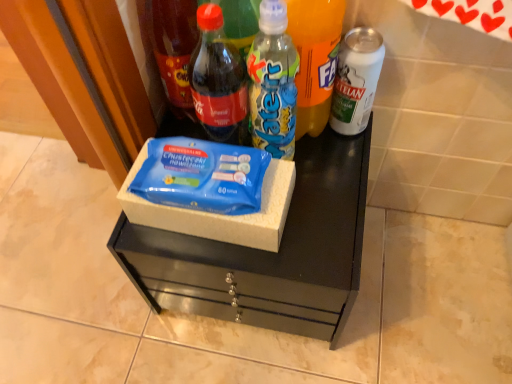
Question: Can you confirm if translucent plastic water bottle at center, which is counted as the third bottle, starting from the right, is smaller than matte glass bottle at upper left, which ranks as the first bottle in left-to-right order?

Choices:
 (A) yes
 (B) no

Answer: (A)

Question: Would you say translucent plastic water bottle at center, which is counted as the third bottle, starting from the right, is a long distance from matte glass bottle at upper left, which ranks as the first bottle in left-to-right order?

Choices:
 (A) no
 (B) yes

Answer: (A)

Question: Is translucent plastic water bottle at center, the 3th bottle from the left, behind matte glass bottle at upper left, arranged as the 5th bottle when viewed from the right?

Choices:
 (A) no
 (B) yes

Answer: (A)

Question: From the image's perspective, is translucent plastic water bottle at center, the 3th bottle from the left, located above matte glass bottle at upper left, which ranks as the first bottle in left-to-right order?

Choices:
 (A) yes
 (B) no

Answer: (B)

Question: From a real-world perspective, does translucent plastic water bottle at center, which is counted as the third bottle, starting from the right, stand above matte glass bottle at upper left, which ranks as the first bottle in left-to-right order?

Choices:
 (A) yes
 (B) no

Answer: (B)

Question: Is blue matte wipes at center wider or thinner than translucent plastic bottle at center, the fourth bottle positioned from the left?

Choices:
 (A) wide
 (B) thin

Answer: (A)

Question: Based on their positions, is blue matte wipes at center located to the left or right of translucent plastic bottle at center, placed as the second bottle when sorted from right to left?

Choices:
 (A) right
 (B) left

Answer: (B)

Question: Is point (302, 213) positioned closer to the camera than point (308, 77)?

Choices:
 (A) farther
 (B) closer

Answer: (A)

Question: Choose the correct answer: Is blue matte wipes at center inside translucent plastic bottle at center, the fourth bottle positioned from the left, or outside it?

Choices:
 (A) outside
 (B) inside

Answer: (A)

Question: Is translucent plastic water bottle at center, which is counted as the third bottle, starting from the right, in front of or behind blue matte wipes at center in the image?

Choices:
 (A) behind
 (B) front

Answer: (B)

Question: Looking at their shapes, would you say translucent plastic water bottle at center, which is counted as the third bottle, starting from the right, is wider or thinner than blue matte wipes at center?

Choices:
 (A) thin
 (B) wide

Answer: (A)

Question: Which is correct: translucent plastic water bottle at center, which is counted as the third bottle, starting from the right, is inside blue matte wipes at center, or outside of it?

Choices:
 (A) outside
 (B) inside

Answer: (A)

Question: Does point (283, 36) appear closer or farther from the camera than point (357, 228)?

Choices:
 (A) closer
 (B) farther

Answer: (A)

Question: From a real-world perspective, is matte glass bottle at center, positioned as the second bottle in left-to-right order, above or below white matte can at right, marked as the 1th bottle in a right-to-left arrangement?

Choices:
 (A) below
 (B) above

Answer: (B)

Question: In the image, is matte glass bottle at center, positioned as the 4th bottle in right-to-left order, on the left side or the right side of white matte can at right, marked as the 1th bottle in a right-to-left arrangement?

Choices:
 (A) left
 (B) right

Answer: (A)